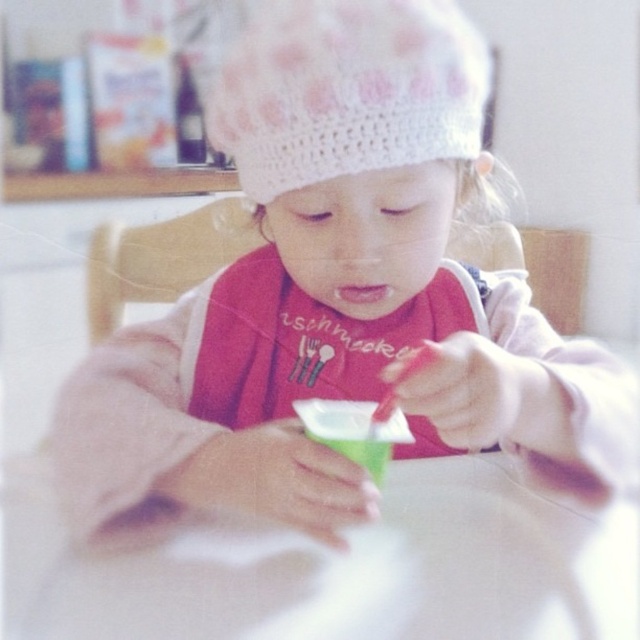
Is white glossy table at center below green plastic cup at center?

Yes, white glossy table at center is below green plastic cup at center.

Can you confirm if white glossy table at center is shorter than green plastic cup at center?

In fact, white glossy table at center may be taller than green plastic cup at center.

Is point (493, 602) behind point (349, 440)?

Yes.

Where is `white glossy table at center`? Image resolution: width=640 pixels, height=640 pixels. white glossy table at center is located at coordinates (310, 566).

Can you confirm if white knitted hat at upper center is positioned above green plastic cup at center?

Yes, white knitted hat at upper center is above green plastic cup at center.

Can you confirm if white knitted hat at upper center is positioned to the left of green plastic cup at center?

Yes, white knitted hat at upper center is to the left of green plastic cup at center.

Is point (259, 72) less distant than point (372, 451)?

No, it is not.

This screenshot has height=640, width=640. In order to click on white knitted hat at upper center in this screenshot , I will do `click(346, 90)`.

Who is more forward, (x=51, y=620) or (x=307, y=10)?

Point (x=51, y=620) is in front.

Is white glossy table at center further to camera compared to white knitted hat at upper center?

No.

Is point (480, 467) more distant than point (385, 100)?

That is True.

I want to click on white glossy table at center, so click(x=310, y=566).